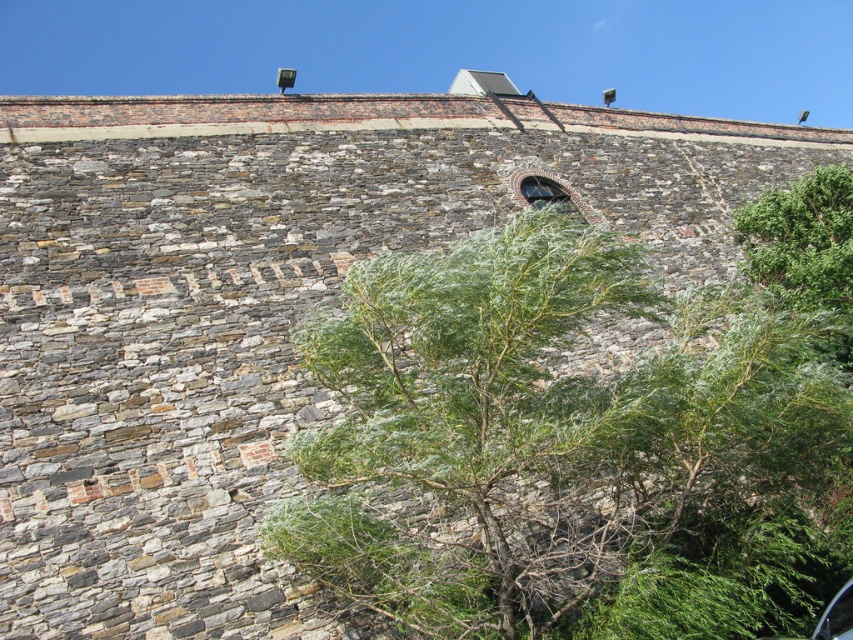
Can you confirm if green leafy tree at center is bigger than green leafy bush at upper right?

Indeed, green leafy tree at center has a larger size compared to green leafy bush at upper right.

Looking at this image, is green leafy tree at center shorter than green leafy bush at upper right?

In fact, green leafy tree at center may be taller than green leafy bush at upper right.

Is point (543, 291) in front of point (824, 285)?

Yes, it is in front of point (824, 285).

Find the location of a particular element. The height and width of the screenshot is (640, 853). green leafy tree at center is located at coordinates (553, 436).